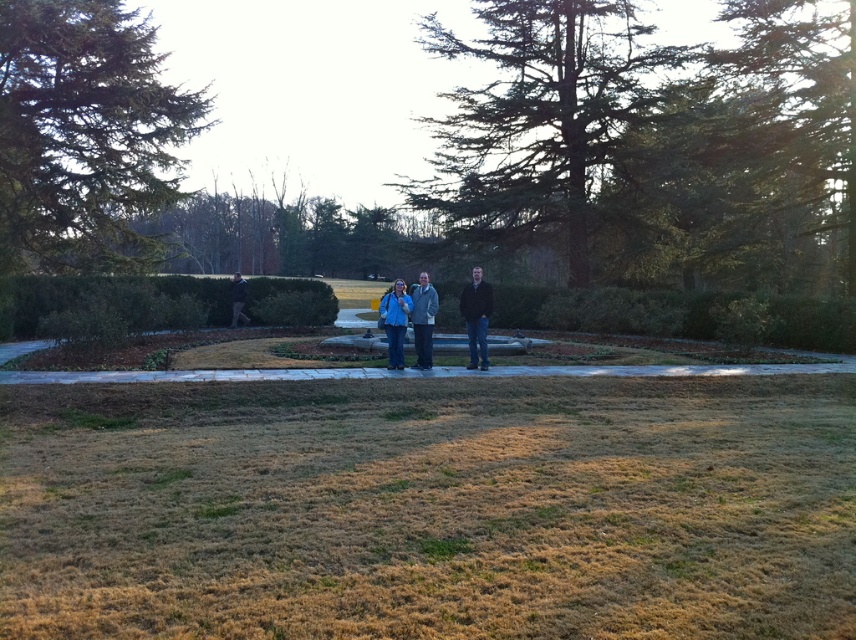
Measure the distance from brown grass at center to blue fabric jacket at center.

brown grass at center and blue fabric jacket at center are 24.89 feet apart from each other.

Does point (384, 413) lie in front of point (395, 282)?

Yes, it is in front of point (395, 282).

Locate an element on the screen. The image size is (856, 640). brown grass at center is located at coordinates tap(431, 508).

Is dark brown leather jacket at center smaller than gray wool coat at center?

Correct, dark brown leather jacket at center occupies less space than gray wool coat at center.

Can you confirm if dark brown leather jacket at center is wider than gray wool coat at center?

Incorrect, dark brown leather jacket at center's width does not surpass gray wool coat at center's.

Between point (467, 300) and point (423, 323), which one is positioned behind?

The point (467, 300) is behind.

Image resolution: width=856 pixels, height=640 pixels. I want to click on dark brown leather jacket at center, so click(x=476, y=317).

Between brown grass at center and black jacket at left, which one appears on the left side from the viewer's perspective?

black jacket at left

Image resolution: width=856 pixels, height=640 pixels. Identify the location of brown grass at center. (431, 508).